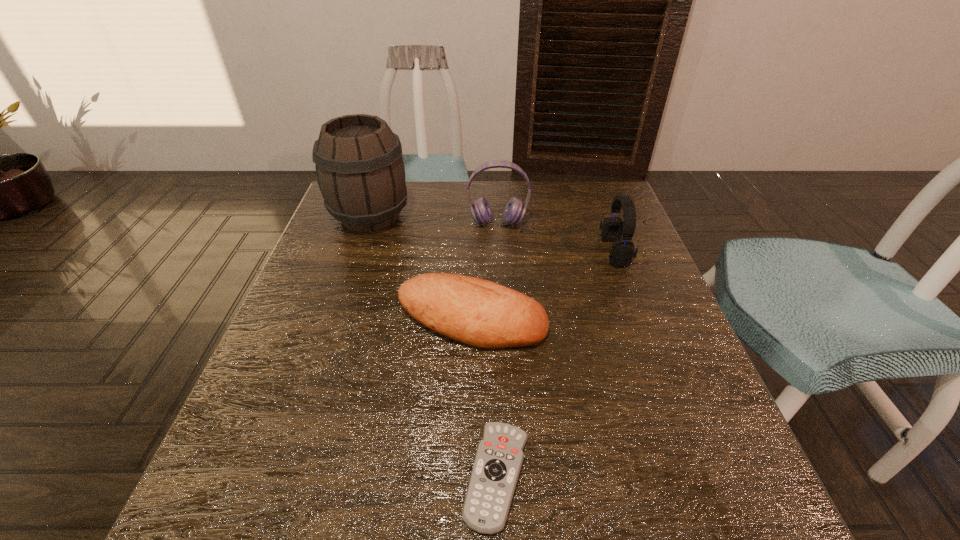
Where is `the tallest object`? The height and width of the screenshot is (540, 960). the tallest object is located at coordinates (360, 171).

Locate an element on the screen. This screenshot has width=960, height=540. wine bucket is located at coordinates (360, 171).

Image resolution: width=960 pixels, height=540 pixels. Find the location of `the fourth shortest object`. the fourth shortest object is located at coordinates (514, 211).

Identify the location of the taller headset. The width and height of the screenshot is (960, 540). [514, 211].

At what (x,y) coordinates should I click in order to perform the action: click on the right headset. Please return your answer as a coordinate pair (x, y). Image resolution: width=960 pixels, height=540 pixels. Looking at the image, I should click on (621, 254).

Find the location of a particular element. the third tallest object is located at coordinates (621, 254).

This screenshot has height=540, width=960. I want to click on the second nearest object, so click(x=477, y=312).

This screenshot has height=540, width=960. What are the coordinates of `the fourth tallest object` in the screenshot? It's located at (477, 312).

Where is `the shortest object`? The image size is (960, 540). the shortest object is located at coordinates (x=499, y=456).

At what (x,y) coordinates should I click in order to perform the action: click on the nearest object. Please return your answer as a coordinate pair (x, y). Looking at the image, I should click on (499, 456).